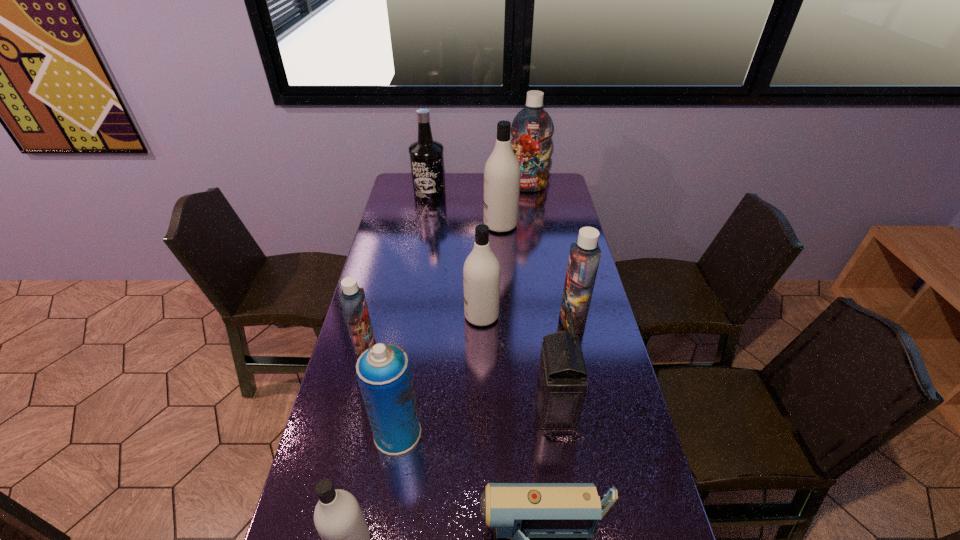
Image resolution: width=960 pixels, height=540 pixels. What are the coordinates of `blank region between the leftmost object and the second smallest blue shampoo` in the screenshot? It's located at (468, 333).

The image size is (960, 540). Identify the location of empty space that is in between the black liquor and the aerosol can. (414, 314).

You are a GUI agent. You are given a task and a screenshot of the screen. Output one action in this format:
    pyautogui.click(x=<x>, y=<y>)
    Task: Click on the unoccupied position between the lantern and the biggest blue shampoo
    Image resolution: width=960 pixels, height=540 pixels.
    Given the screenshot: What is the action you would take?
    pyautogui.click(x=541, y=298)

Where is `free point between the second nearest white shampoo and the lantern`? The image size is (960, 540). free point between the second nearest white shampoo and the lantern is located at coordinates (518, 362).

At what (x,y) coordinates should I click in order to perform the action: click on vacant space that's between the second smallest blue shampoo and the aerosol can. Please return your answer as a coordinate pair (x, y). The image size is (960, 540). Looking at the image, I should click on (485, 377).

Select which object is the fourth closest to the smallest blue shampoo. Please provide its 2D coordinates. Your answer should be formatted as a tuple, i.e. [(x, y)], where the tuple contains the x and y coordinates of a point satisfying the conditions above.

[(560, 387)]

Point out which object is positioned as the second nearest to the leftmost object. Please provide its 2D coordinates. Your answer should be formatted as a tuple, i.e. [(x, y)], where the tuple contains the x and y coordinates of a point satisfying the conditions above.

[(481, 272)]

Identify which shampoo is the second closest to the aerosol can. Please provide its 2D coordinates. Your answer should be formatted as a tuple, i.e. [(x, y)], where the tuple contains the x and y coordinates of a point satisfying the conditions above.

[(353, 301)]

I want to click on shampoo that is the third closest one to the farthest blue shampoo, so click(481, 272).

Where is `the second closest white shampoo to the second biggest blue shampoo`? The width and height of the screenshot is (960, 540). the second closest white shampoo to the second biggest blue shampoo is located at coordinates (502, 172).